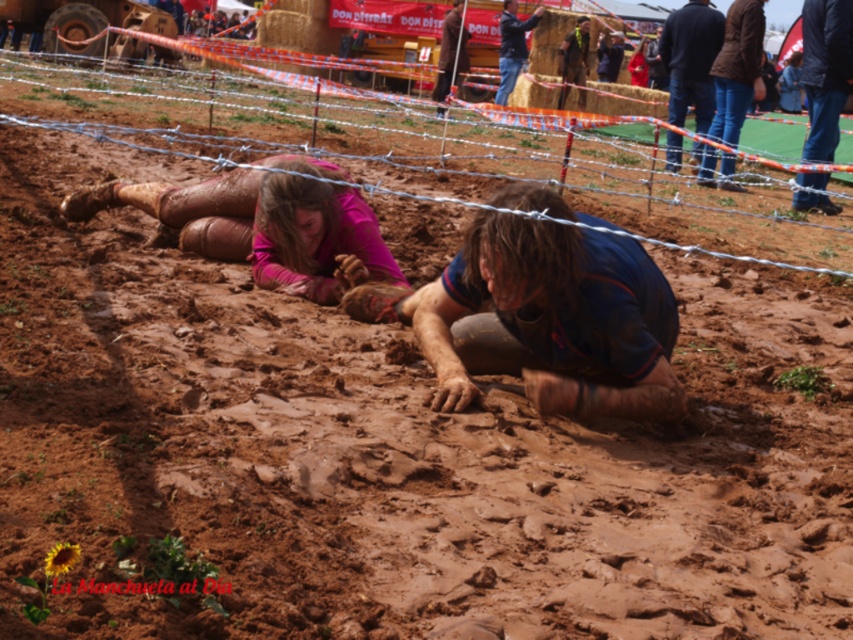
Is barbed wire at center wider than pink matte/skinny pants at center?

Yes, barbed wire at center is wider than pink matte/skinny pants at center.

I want to click on barbed wire at center, so click(x=230, y=157).

Can you confirm if pink matte/skinny pants at center is bigger than dark blue shirt at upper right?

Actually, pink matte/skinny pants at center might be smaller than dark blue shirt at upper right.

Between pink matte/skinny pants at center and dark blue shirt at upper right, which one has less height?

Standing shorter between the two is pink matte/skinny pants at center.

Who is more forward, [292,156] or [659,51]?

Point [292,156]

Where is `pink matte/skinny pants at center`? Image resolution: width=853 pixels, height=640 pixels. pink matte/skinny pants at center is located at coordinates (263, 228).

Can you confirm if pink matte/skinny pants at center is positioned above dark blue jeans at upper right?

Incorrect, pink matte/skinny pants at center is not positioned above dark blue jeans at upper right.

Between pink matte/skinny pants at center and dark blue jeans at upper right, which one is positioned lower?

pink matte/skinny pants at center is lower down.

Find the location of a particular element. pink matte/skinny pants at center is located at coordinates (263, 228).